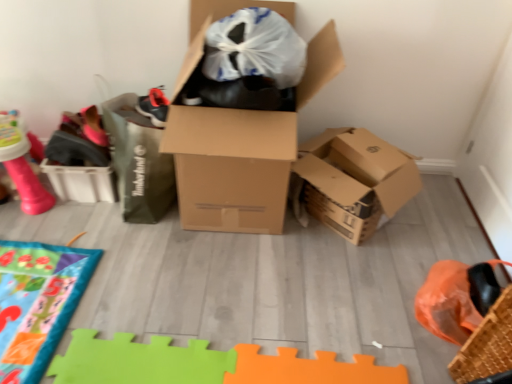
What do you see at coordinates (486, 332) in the screenshot? Image resolution: width=512 pixels, height=384 pixels. I see `woven brown basket at lower right` at bounding box center [486, 332].

What are the coordinates of `woven brown basket at lower right` in the screenshot? It's located at (486, 332).

Find the location of a particular element. toy that is under the brown cardboard box at center (from a real-world perspective) is located at coordinates (21, 165).

Considering the relative sizes of pink rubber toy at upper left and brown cardboard box at center in the image provided, is pink rubber toy at upper left taller than brown cardboard box at center?

In fact, pink rubber toy at upper left may be shorter than brown cardboard box at center.

Is pink rubber toy at upper left thinner than brown cardboard box at center?

Correct, the width of pink rubber toy at upper left is less than that of brown cardboard box at center.

From the picture: Considering the sizes of objects brown cardboard box at center and pink rubber toy at upper left in the image provided, who is thinner, brown cardboard box at center or pink rubber toy at upper left?

Thinner between the two is pink rubber toy at upper left.

Looking at the image, does brown cardboard box at center seem bigger or smaller compared to pink rubber toy at upper left?

Considering their sizes, brown cardboard box at center takes up more space than pink rubber toy at upper left.

In the scene shown: Between brown cardboard box at center and pink rubber toy at upper left, which one is positioned in front?

Positioned in front is brown cardboard box at center.

Is the surface of brown cardboard box at center in direct contact with pink rubber toy at upper left?

No, brown cardboard box at center is not making contact with pink rubber toy at upper left.

Is pink rubber toy at upper left looking in the opposite direction of woven brown basket at lower right?

No, pink rubber toy at upper left is not facing away from woven brown basket at lower right.

Between point (11, 153) and point (487, 268), which one is positioned behind?

The point (11, 153) is farther.

From the image's perspective, is pink rubber toy at upper left above woven brown basket at lower right?

Yes.

Is pink rubber toy at upper left in front of or behind woven brown basket at lower right in the image?

Clearly, pink rubber toy at upper left is behind woven brown basket at lower right.

Considering the relative positions of woven brown basket at lower right and pink rubber toy at upper left in the image provided, is woven brown basket at lower right to the left or to the right of pink rubber toy at upper left?

Clearly, woven brown basket at lower right is on the right of pink rubber toy at upper left in the image.

Can you see woven brown basket at lower right touching pink rubber toy at upper left?

No, woven brown basket at lower right is not next to pink rubber toy at upper left.

Would you say woven brown basket at lower right is inside or outside pink rubber toy at upper left?

The correct answer is: outside.

Between point (509, 302) and point (16, 157), which one is positioned behind?

The point (16, 157) is behind.

Between woven brown basket at lower right and brown cardboard box at center, which one has more height?

Standing taller between the two is brown cardboard box at center.

Considering the relative sizes of woven brown basket at lower right and brown cardboard box at center in the image provided, is woven brown basket at lower right thinner than brown cardboard box at center?

Indeed, woven brown basket at lower right has a lesser width compared to brown cardboard box at center.

Which is nearer, (x=501, y=323) or (x=250, y=160)?

Point (x=501, y=323) appears to be closer to the viewer than point (x=250, y=160).

From the image's perspective, who appears lower, woven brown basket at lower right or brown cardboard box at center?

From the image's view, woven brown basket at lower right is below.

Between brown cardboard box at center and woven brown basket at lower right, which one appears on the right side from the viewer's perspective?

From the viewer's perspective, woven brown basket at lower right appears more on the right side.

Considering the relative sizes of brown cardboard box at center and woven brown basket at lower right in the image provided, is brown cardboard box at center taller than woven brown basket at lower right?

Indeed, brown cardboard box at center has a greater height compared to woven brown basket at lower right.

Which point is more forward, (237, 176) or (506, 292)?

Positioned in front is point (506, 292).

At what (x,y) coordinates should I click in order to perform the action: click on box above the woven brown basket at lower right (from a real-world perspective). Please return your answer as a coordinate pair (x, y). This screenshot has height=384, width=512. Looking at the image, I should click on (231, 167).

I want to click on toy on the left of brown cardboard box at center, so click(x=21, y=165).

You are a GUI agent. You are given a task and a screenshot of the screen. Output one action in this format:
    pyautogui.click(x=<x>, y=<y>)
    Task: Click on the box on the right of pink rubber toy at upper left
    
    Given the screenshot: What is the action you would take?
    pyautogui.click(x=231, y=167)

Considering their positions, is brown cardboard box at center positioned further to woven brown basket at lower right than pink rubber toy at upper left?

Based on the image, pink rubber toy at upper left appears to be further to woven brown basket at lower right.

From the image, which object appears to be nearer to pink rubber toy at upper left, brown cardboard box at center or woven brown basket at lower right?

The object closer to pink rubber toy at upper left is brown cardboard box at center.

From the image, which object appears to be nearer to woven brown basket at lower right, pink rubber toy at upper left or brown cardboard box at center?

brown cardboard box at center is closer to woven brown basket at lower right.

Looking at the image, which one is located further to pink rubber toy at upper left, woven brown basket at lower right or brown cardboard box at center?

Among the two, woven brown basket at lower right is located further to pink rubber toy at upper left.

Estimate the real-world distances between objects in this image. Which object is further from brown cardboard box at center, woven brown basket at lower right or pink rubber toy at upper left?

woven brown basket at lower right is further to brown cardboard box at center.

Estimate the real-world distances between objects in this image. Which object is further from brown cardboard box at center, pink rubber toy at upper left or woven brown basket at lower right?

woven brown basket at lower right is further to brown cardboard box at center.

You are a GUI agent. You are given a task and a screenshot of the screen. Output one action in this format:
    pyautogui.click(x=<x>, y=<y>)
    Task: Click on the box between pink rubber toy at upper left and woven brown basket at lower right in the horizontal direction
    The image size is (512, 384).
    Given the screenshot: What is the action you would take?
    231,167